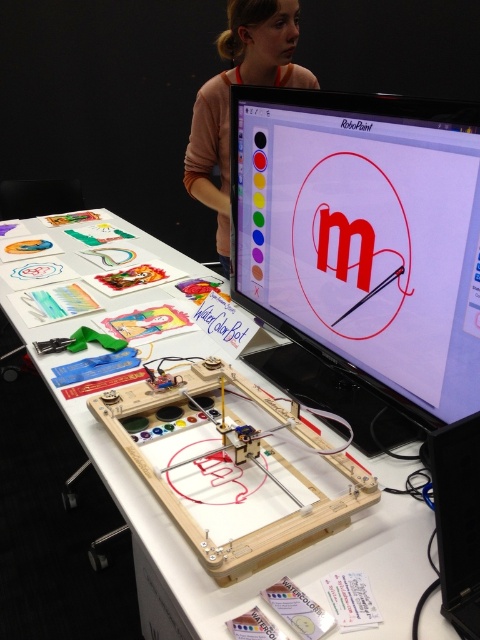
You are a customer at a tech fair and see the white wood table at center and the wooden board game at center. If you want to place a new item on the surface that is higher, which object should you choose?

The white wood table at center is much taller than the wooden board game at center, so you should place the new item on the white wood table at center.

You are standing in front of the WaterColorBot demonstration. There is a white wood table at center where the machine is placed. Can you tell me what is located at the point with coordinates (191,548)?

The point at coordinates (191,548) is where the white wood table at center is located.

You are setting up a presentation and need to place a new projector screen to the left of the white wood table at center. Can the matte plastic monitor at upper center interfere with the placement?

The matte plastic monitor at upper center is positioned on the right side of the white wood table at center, so placing the projector screen to the left of the white wood table at center would not interfere with the matte plastic monitor at upper center.